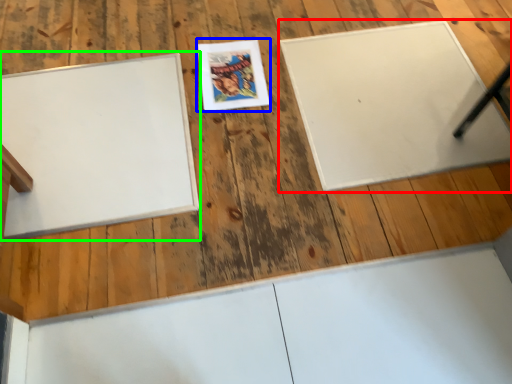
Question: Which object is the closest to the bulletin board (highlighted by a red box)? Choose among these: comic book (highlighted by a blue box) or bulletin board (highlighted by a green box).

Choices:
 (A) comic book
 (B) bulletin board

Answer: (A)